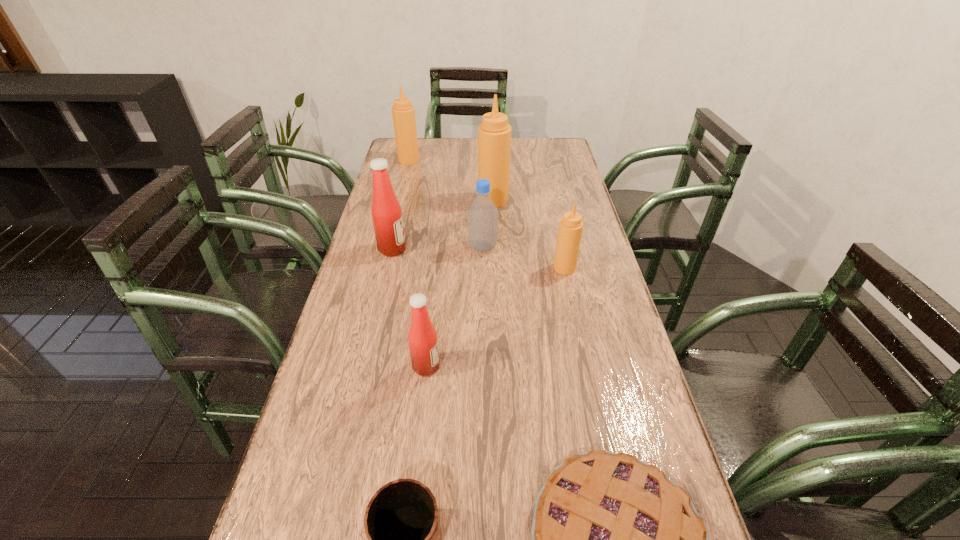
At what (x,y) coordinates should I click in order to perform the action: click on object that can be found as the second closest to the seventh tallest object. Please return your answer as a coordinate pair (x, y). Image resolution: width=960 pixels, height=540 pixels. Looking at the image, I should click on (423, 343).

The image size is (960, 540). Find the location of `condiment that is the second closest to the farthest tan condiment`. condiment that is the second closest to the farthest tan condiment is located at coordinates (387, 218).

Select which condiment is the closest to the third condiment from right to left. Please provide its 2D coordinates. Your answer should be formatted as a tuple, i.e. [(x, y)], where the tuple contains the x and y coordinates of a point satisfying the conditions above.

[(387, 218)]

Identify which tan condiment is the second closest to the leftmost tan condiment. Please provide its 2D coordinates. Your answer should be formatted as a tuple, i.e. [(x, y)], where the tuple contains the x and y coordinates of a point satisfying the conditions above.

[(570, 230)]

Where is `the third closest tan condiment to the gray bottle`? This screenshot has height=540, width=960. the third closest tan condiment to the gray bottle is located at coordinates (403, 112).

This screenshot has height=540, width=960. In order to click on free space that satisfies the following two spatial constraints: 1. on the front side of the leftmost tan condiment; 2. on the left side of the fifth farthest object in this screenshot , I will do `click(381, 268)`.

Find the location of `free spot that satisfies the following two spatial constraints: 1. on the front side of the bottle; 2. on the right side of the fourth nearest object`. free spot that satisfies the following two spatial constraints: 1. on the front side of the bottle; 2. on the right side of the fourth nearest object is located at coordinates (483, 268).